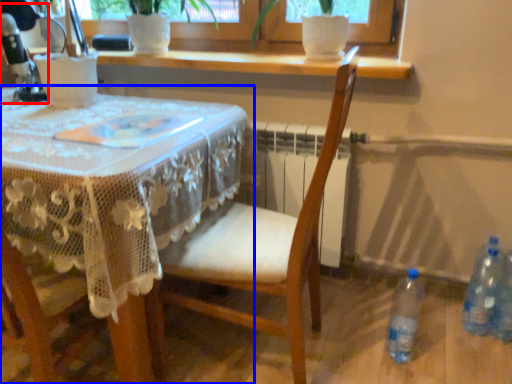
Question: Which point is closer to the camera, sewing machine (highlighted by a red box) or table (highlighted by a blue box)?

Choices:
 (A) sewing machine
 (B) table

Answer: (B)